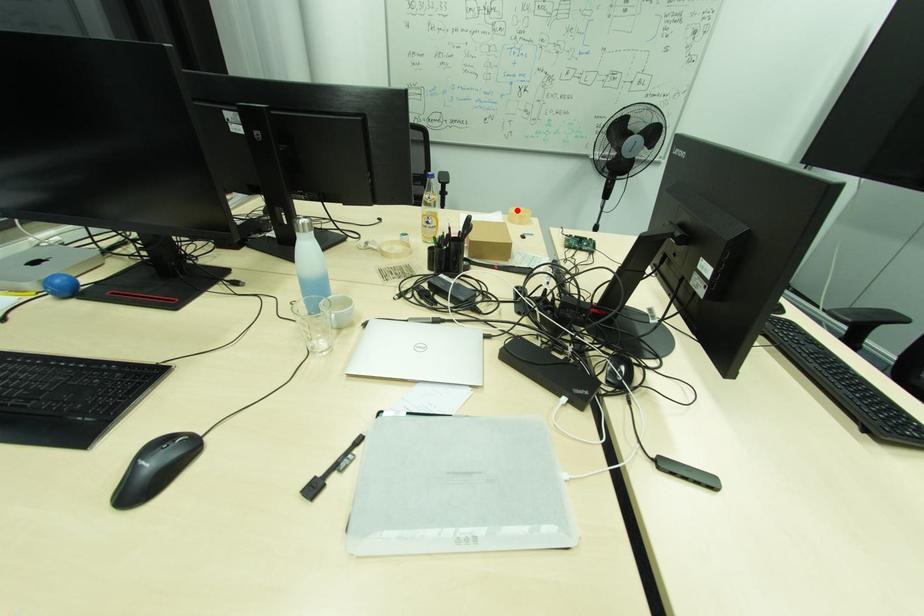
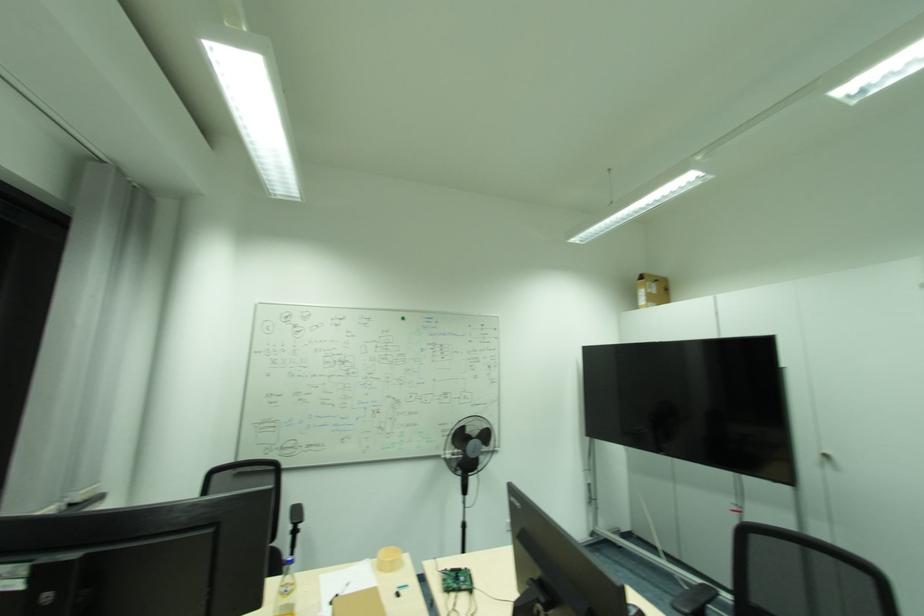
Find the pixel in the second image that matches the highlighted location in the first image.

(386, 553)